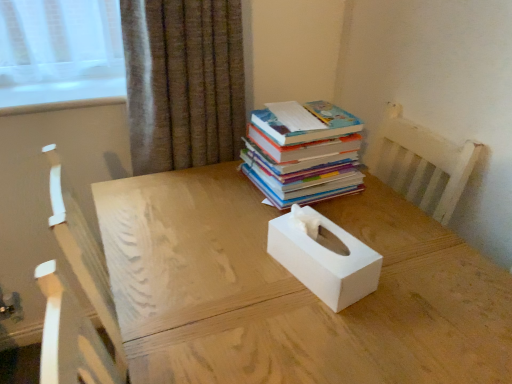
Describe the element at coordinates (324, 257) in the screenshot. Image resolution: width=512 pixels, height=384 pixels. I see `white matte tissue box at center` at that location.

You are a GUI agent. You are given a task and a screenshot of the screen. Output one action in this format:
    pyautogui.click(x=<x>, y=<y>)
    Task: Click on the brown textured curtain at upper center
    Image resolution: width=512 pixels, height=384 pixels.
    Given the screenshot: What is the action you would take?
    pyautogui.click(x=183, y=82)

The height and width of the screenshot is (384, 512). Describe the element at coordinates (304, 155) in the screenshot. I see `hardcover books at upper right` at that location.

Locate an element on the screen. Image resolution: width=512 pixels, height=384 pixels. white matte tissue box at center is located at coordinates (324, 257).

In terms of height, does hardcover books at upper right look taller or shorter compared to white matte tissue box at center?

Considering their sizes, hardcover books at upper right has more height than white matte tissue box at center.

Considering the sizes of objects hardcover books at upper right and white matte tissue box at center in the image provided, who is wider, hardcover books at upper right or white matte tissue box at center?

With larger width is hardcover books at upper right.

Looking at this image, considering the relative sizes of hardcover books at upper right and white matte tissue box at center in the image provided, is hardcover books at upper right bigger than white matte tissue box at center?

Yes, hardcover books at upper right is bigger than white matte tissue box at center.

Can you tell me how much white matte tissue box at center and hardcover books at upper right differ in facing direction?

The angular difference between white matte tissue box at center and hardcover books at upper right is 89.8 degrees.

From a real-world perspective, is white matte tissue box at center positioned above or below hardcover books at upper right?

In terms of real-world spatial position, white matte tissue box at center is below hardcover books at upper right.

Can you confirm if white matte tissue box at center is smaller than hardcover books at upper right?

Incorrect, white matte tissue box at center is not smaller in size than hardcover books at upper right.

Is white matte tissue box at center far away from brown textured curtain at upper center?

Actually, white matte tissue box at center and brown textured curtain at upper center are a little close together.

From the image's perspective, is white matte tissue box at center located above or below brown textured curtain at upper center?

Based on their image positions, white matte tissue box at center is located beneath brown textured curtain at upper center.

Which object is wider, white matte tissue box at center or brown textured curtain at upper center?

white matte tissue box at center is wider.

Identify the location of curtain to the left of white matte tissue box at center. (183, 82).

Is brown textured curtain at upper center oriented towards white matte tissue box at center?

Yes.

Is brown textured curtain at upper center far away from white matte tissue box at center?

No, brown textured curtain at upper center is not far from white matte tissue box at center.

How much distance is there between brown textured curtain at upper center and white matte tissue box at center?

brown textured curtain at upper center and white matte tissue box at center are 22.23 inches apart.

From a real-world perspective, relative to white matte tissue box at center, is brown textured curtain at upper center vertically above or below?

brown textured curtain at upper center is situated higher than white matte tissue box at center in the real world.

Is brown textured curtain at upper center situated inside white matte tissue box at center or outside?

The correct answer is: outside.

From the image's perspective, is brown textured curtain at upper center beneath white matte tissue box at center?

No, from the image's perspective, brown textured curtain at upper center is not below white matte tissue box at center.

Is white matte tissue box at center surrounded by white matte tissue box at center?

No, white matte tissue box at center is not inside white matte tissue box at center.

Find the location of `box behind the white matte tissue box at center`. box behind the white matte tissue box at center is located at coordinates (324, 257).

Is white matte tissue box at center closer to the viewer compared to white matte tissue box at center?

No, the depth of white matte tissue box at center is greater than that of white matte tissue box at center.

Between white matte tissue box at center and white matte tissue box at center, which one appears on the right side from the viewer's perspective?

From the viewer's perspective, white matte tissue box at center appears more on the right side.

Does point (329, 107) come behind point (470, 268)?

Yes, it is behind point (470, 268).

Is hardcover books at upper right facing away from white matte tissue box at center?

No, white matte tissue box at center is not at the back of hardcover books at upper right.

From a real-world perspective, is hardcover books at upper right below white matte tissue box at center?

No, from a real-world perspective, hardcover books at upper right is not under white matte tissue box at center.

From the image's perspective, is hardcover books at upper right above or below white matte tissue box at center?

From the image's perspective, hardcover books at upper right appears above white matte tissue box at center.

Find the location of `book to the left of white matte tissue box at center`. book to the left of white matte tissue box at center is located at coordinates (304, 155).

There is a white matte tissue box at center. Where is `book above it (from a real-world perspective)`? book above it (from a real-world perspective) is located at coordinates (304, 155).

Based on their spatial positions, is brown textured curtain at upper center or white matte tissue box at center further from white matte tissue box at center?

brown textured curtain at upper center lies further to white matte tissue box at center than the other object.

When comparing their distances from hardcover books at upper right, does brown textured curtain at upper center or white matte tissue box at center seem closer?

Based on the image, white matte tissue box at center appears to be nearer to hardcover books at upper right.

When comparing their distances from white matte tissue box at center, does white matte tissue box at center or hardcover books at upper right seem closer?

The object closer to white matte tissue box at center is white matte tissue box at center.

Estimate the real-world distances between objects in this image. Which object is closer to brown textured curtain at upper center, white matte tissue box at center or hardcover books at upper right?

hardcover books at upper right is closer to brown textured curtain at upper center.

Consider the image. Estimate the real-world distances between objects in this image. Which object is closer to hardcover books at upper right, white matte tissue box at center or white matte tissue box at center?

white matte tissue box at center lies closer to hardcover books at upper right than the other object.

When comparing their distances from hardcover books at upper right, does brown textured curtain at upper center or white matte tissue box at center seem closer?

Based on the image, white matte tissue box at center appears to be nearer to hardcover books at upper right.

Looking at the image, which one is located closer to white matte tissue box at center, white matte tissue box at center or hardcover books at upper right?

The object closer to white matte tissue box at center is white matte tissue box at center.

From the image, which object appears to be farther from white matte tissue box at center, brown textured curtain at upper center or white matte tissue box at center?

brown textured curtain at upper center lies further to white matte tissue box at center than the other object.

At what (x,y) coordinates should I click in order to perform the action: click on box that lies between brown textured curtain at upper center and white matte tissue box at center from top to bottom. Please return your answer as a coordinate pair (x, y). This screenshot has width=512, height=384. Looking at the image, I should click on (324, 257).

Locate an element on the screen. The height and width of the screenshot is (384, 512). book between brown textured curtain at upper center and white matte tissue box at center vertically is located at coordinates (304, 155).

The width and height of the screenshot is (512, 384). What are the coordinates of `book between brown textured curtain at upper center and white matte tissue box at center in the up-down direction` in the screenshot? It's located at (304, 155).

At what (x,y) coordinates should I click in order to perform the action: click on box between hardcover books at upper right and white matte tissue box at center in the vertical direction. Please return your answer as a coordinate pair (x, y). This screenshot has height=384, width=512. Looking at the image, I should click on (324, 257).